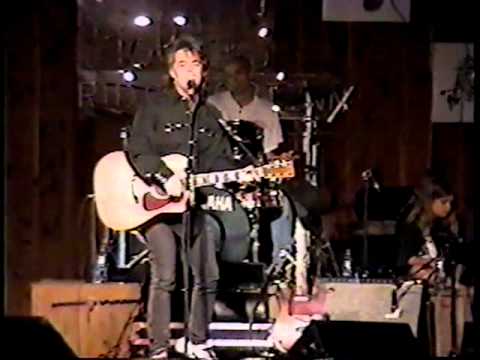
Where is `amplifier`? The height and width of the screenshot is (360, 480). amplifier is located at coordinates (373, 296).